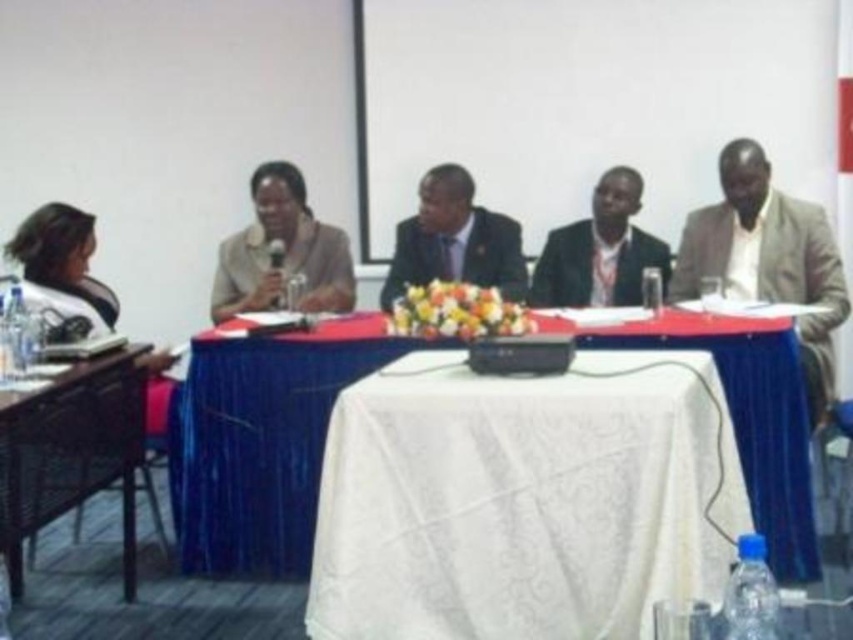
You are standing in the room where the formal meeting is taking place. You need to locate the white fabric table at lower left. According to the coordinates provided, where would you find it?

The white fabric table at lower left is located at point (70, 452).

You are organizing a small event and need to place a 2.5 meter long banner on one of the tables. Which table, the white lace tablecloth at center or the white fabric table at lower left, can accommodate the banner without it hanging off the edges?

The white lace tablecloth at center has a larger width than the white fabric table at lower left, so the banner can be placed on the white lace tablecloth at center without it hanging off the edges.